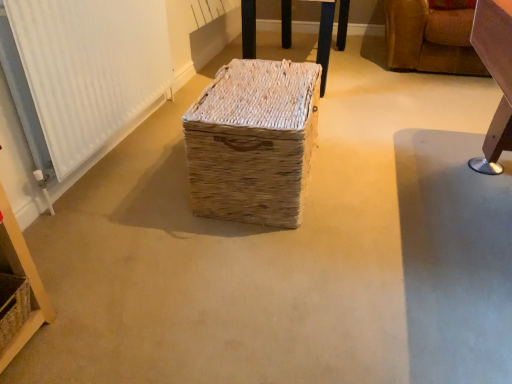
Describe the element at coordinates (88, 69) in the screenshot. The height and width of the screenshot is (384, 512). I see `white textured radiator at left` at that location.

Where is `leather sofa at upper right, which ranks as the second furniture in left-to-right order`? leather sofa at upper right, which ranks as the second furniture in left-to-right order is located at coordinates (430, 39).

From a real-world perspective, is leather sofa at upper right, which is the first furniture from right to left, above or below natural woven basket at lower left?

In terms of real-world spatial position, leather sofa at upper right, which is the first furniture from right to left, is above natural woven basket at lower left.

Is leather sofa at upper right, which ranks as the second furniture in left-to-right order, taller or shorter than natural woven basket at lower left?

Considering their sizes, leather sofa at upper right, which ranks as the second furniture in left-to-right order, has more height than natural woven basket at lower left.

Can you confirm if leather sofa at upper right, which ranks as the second furniture in left-to-right order, is thinner than natural woven basket at lower left?

Incorrect, the width of leather sofa at upper right, which ranks as the second furniture in left-to-right order, is not less than that of natural woven basket at lower left.

Which of these two, leather sofa at upper right, which ranks as the second furniture in left-to-right order, or natural woven basket at lower left, is smaller?

natural woven basket at lower left.

How many degrees apart are the facing directions of natural woven basket at center, which ranks as the first furniture in left-to-right order, and leather sofa at upper right, which ranks as the second furniture in left-to-right order?

They differ by 88.3 degrees in their facing directions.

From the image's perspective, does natural woven basket at center, the second furniture positioned from the right, appear higher than leather sofa at upper right, which ranks as the second furniture in left-to-right order?

Correct, natural woven basket at center, the second furniture positioned from the right, appears higher than leather sofa at upper right, which ranks as the second furniture in left-to-right order, in the image.

Is natural woven basket at center, which ranks as the first furniture in left-to-right order, oriented away from leather sofa at upper right, which ranks as the second furniture in left-to-right order?

No.

Does point (285, 17) come closer to viewer compared to point (451, 30)?

No, (285, 17) is further to viewer.

Which is behind, point (7, 329) or point (476, 74)?

The point (476, 74) is more distant.

Which object is positioned more to the right, natural woven basket at lower left or leather sofa at upper right, which ranks as the second furniture in left-to-right order?

leather sofa at upper right, which ranks as the second furniture in left-to-right order.

Measure the distance from natural woven basket at lower left to leather sofa at upper right, which is the first furniture from right to left.

natural woven basket at lower left is 3.04 meters from leather sofa at upper right, which is the first furniture from right to left.

Is natural woven basket at lower left in contact with leather sofa at upper right, which ranks as the second furniture in left-to-right order?

No, natural woven basket at lower left is not making contact with leather sofa at upper right, which ranks as the second furniture in left-to-right order.

Considering the positions of objects natural woven basket at center, which ranks as the first furniture in left-to-right order, and white textured radiator at left in the image provided, who is more to the left, natural woven basket at center, which ranks as the first furniture in left-to-right order, or white textured radiator at left?

white textured radiator at left is more to the left.

Considering the relative sizes of natural woven basket at center, which ranks as the first furniture in left-to-right order, and white textured radiator at left in the image provided, is natural woven basket at center, which ranks as the first furniture in left-to-right order, smaller than white textured radiator at left?

No.

Which point is more distant from viewer, (342,26) or (22,62)?

The point (342,26) is more distant.

From the picture: Considering the sizes of natural woven basket at center, which ranks as the first furniture in left-to-right order, and white textured radiator at left in the image, is natural woven basket at center, which ranks as the first furniture in left-to-right order, wider or thinner than white textured radiator at left?

natural woven basket at center, which ranks as the first furniture in left-to-right order, is wider than white textured radiator at left.

Is natural woven basket at lower left completely or partially inside white textured radiator at left?

No, natural woven basket at lower left is not inside white textured radiator at left.

Could you tell me if white textured radiator at left is turned towards natural woven basket at lower left?

No, white textured radiator at left is not oriented towards natural woven basket at lower left.

Which of these two, white textured radiator at left or natural woven basket at lower left, is bigger?

white textured radiator at left.

Considering the sizes of objects white textured radiator at left and natural woven basket at lower left in the image provided, who is wider, white textured radiator at left or natural woven basket at lower left?

natural woven basket at lower left.

Is leather sofa at upper right, which ranks as the second furniture in left-to-right order, not inside natural woven basket at center, the second furniture positioned from the right?

Yes, leather sofa at upper right, which ranks as the second furniture in left-to-right order, is located beyond the bounds of natural woven basket at center, the second furniture positioned from the right.

Which object is closer to the camera, leather sofa at upper right, which ranks as the second furniture in left-to-right order, or natural woven basket at center, which ranks as the first furniture in left-to-right order?

leather sofa at upper right, which ranks as the second furniture in left-to-right order, is closer to the camera.

Is leather sofa at upper right, which ranks as the second furniture in left-to-right order, wider than natural woven basket at center, which ranks as the first furniture in left-to-right order?

Yes, leather sofa at upper right, which ranks as the second furniture in left-to-right order, is wider than natural woven basket at center, which ranks as the first furniture in left-to-right order.

Could you tell me if leather sofa at upper right, which is the first furniture from right to left, is turned towards natural woven basket at center, which ranks as the first furniture in left-to-right order?

No, leather sofa at upper right, which is the first furniture from right to left, is not facing towards natural woven basket at center, which ranks as the first furniture in left-to-right order.

Is white textured radiator at left far from natural woven basket at center?

No, white textured radiator at left is in close proximity to natural woven basket at center.

Between white textured radiator at left and natural woven basket at center, which one has smaller width?

white textured radiator at left.

Would you say white textured radiator at left is outside natural woven basket at center?

Yes, white textured radiator at left is located beyond the bounds of natural woven basket at center.

Who is bigger, white textured radiator at left or natural woven basket at center?

With larger size is natural woven basket at center.

Locate an element on the screen. The width and height of the screenshot is (512, 384). basket below the leather sofa at upper right, which is the first furniture from right to left (from a real-world perspective) is located at coordinates (13, 306).

I want to click on furniture above the natural woven basket at center, which ranks as the first furniture in left-to-right order (from a real-world perspective), so click(x=430, y=39).

Looking at the image, which one is located further to natural woven basket at center, the second furniture positioned from the right, natural woven basket at lower left or natural woven basket at center?

natural woven basket at lower left lies further to natural woven basket at center, the second furniture positioned from the right, than the other object.

Which object lies nearer to the anchor point leather sofa at upper right, which ranks as the second furniture in left-to-right order, natural woven basket at center, which ranks as the first furniture in left-to-right order, or natural woven basket at center?

natural woven basket at center, which ranks as the first furniture in left-to-right order.

Estimate the real-world distances between objects in this image. Which object is closer to natural woven basket at center, natural woven basket at lower left or leather sofa at upper right, which ranks as the second furniture in left-to-right order?

Among the two, natural woven basket at lower left is located nearer to natural woven basket at center.

Looking at the image, which one is located further to white textured radiator at left, natural woven basket at center or natural woven basket at lower left?

natural woven basket at lower left is further to white textured radiator at left.

Which object lies further to the anchor point leather sofa at upper right, which is the first furniture from right to left, natural woven basket at center, the second furniture positioned from the right, or natural woven basket at lower left?

natural woven basket at lower left lies further to leather sofa at upper right, which is the first furniture from right to left, than the other object.

Based on their spatial positions, is natural woven basket at center or natural woven basket at lower left further from natural woven basket at center, the second furniture positioned from the right?

The object further to natural woven basket at center, the second furniture positioned from the right, is natural woven basket at lower left.

Looking at the image, which one is located closer to natural woven basket at center, natural woven basket at lower left or natural woven basket at center, which ranks as the first furniture in left-to-right order?

natural woven basket at center, which ranks as the first furniture in left-to-right order, is positioned closer to the anchor natural woven basket at center.

Based on the photo, which object lies further to the anchor point natural woven basket at center, which ranks as the first furniture in left-to-right order, natural woven basket at lower left or leather sofa at upper right, which is the first furniture from right to left?

natural woven basket at lower left is positioned further to the anchor natural woven basket at center, which ranks as the first furniture in left-to-right order.

The width and height of the screenshot is (512, 384). What are the coordinates of `storage box between white textured radiator at left and leather sofa at upper right, which ranks as the second furniture in left-to-right order, from left to right` in the screenshot? It's located at (252, 141).

I want to click on storage box located between white textured radiator at left and natural woven basket at center, which ranks as the first furniture in left-to-right order, in the depth direction, so click(x=252, y=141).

Locate an element on the screen. furniture between natural woven basket at center and leather sofa at upper right, which is the first furniture from right to left is located at coordinates (325, 39).

You are a GUI agent. You are given a task and a screenshot of the screen. Output one action in this format:
    pyautogui.click(x=<x>, y=<y>)
    Task: Click on the storage box situated between natural woven basket at lower left and leather sofa at upper right, which ranks as the second furniture in left-to-right order, from left to right
    The width and height of the screenshot is (512, 384).
    Given the screenshot: What is the action you would take?
    pyautogui.click(x=252, y=141)